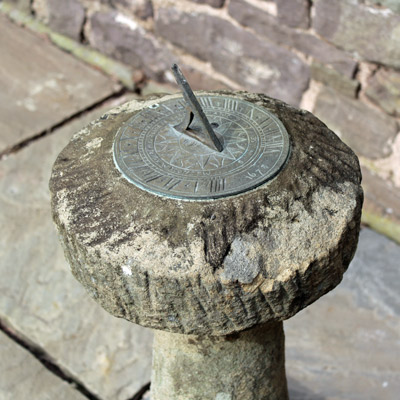
Where is `wall`? wall is located at coordinates (324, 46).